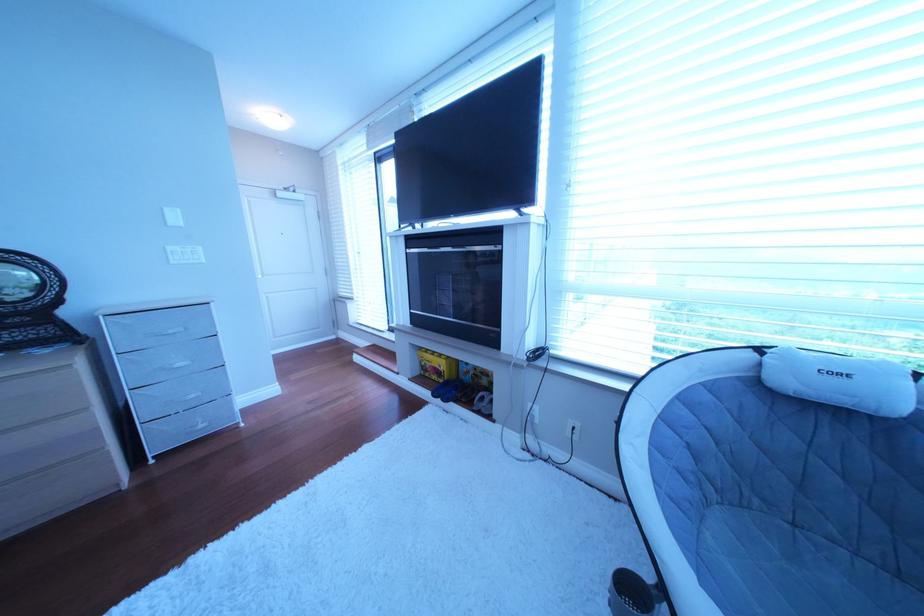
What do you see at coordinates (167, 334) in the screenshot?
I see `the grey drawer handle` at bounding box center [167, 334].